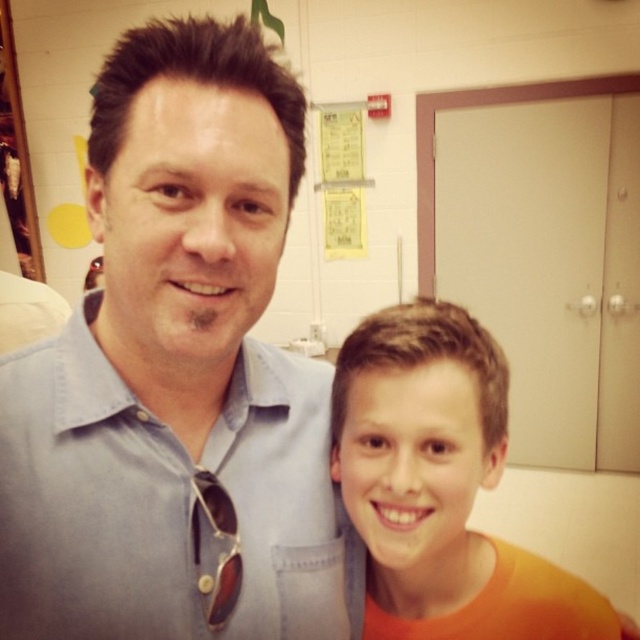
Does light blue cotton shirt at upper left have a larger size compared to orange matte shirt at right?

No, light blue cotton shirt at upper left is not bigger than orange matte shirt at right.

Is light blue cotton shirt at upper left above orange matte shirt at right?

Yes.

Is point (13, 412) positioned behind point (552, 636)?

No, it is in front of (552, 636).

I want to click on light blue cotton shirt at upper left, so click(168, 502).